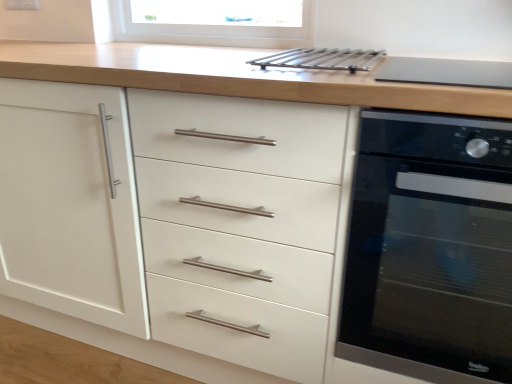
Locate an element on the screen. This screenshot has width=512, height=384. matte black cooktop at upper right is located at coordinates (446, 72).

Does point (493, 78) come closer to viewer compared to point (436, 145)?

No, it is not.

From the image's perspective, does matte black cooktop at upper right appear lower than black glass oven at right?

Incorrect, from the image's perspective, matte black cooktop at upper right is higher than black glass oven at right.

Is matte black cooktop at upper right to the right of black glass oven at right from the viewer's perspective?

In fact, matte black cooktop at upper right is to the left of black glass oven at right.

Is metallic silver rack at upper center to the left of matte black cooktop at upper right from the viewer's perspective?

Correct, you'll find metallic silver rack at upper center to the left of matte black cooktop at upper right.

Is metallic silver rack at upper center positioned beyond the bounds of matte black cooktop at upper right?

Yes.

Is metallic silver rack at upper center shorter than matte black cooktop at upper right?

Indeed, metallic silver rack at upper center has a lesser height compared to matte black cooktop at upper right.

Based on the photo, does black glass oven at right appear on the left side of metallic silver rack at upper center?

Incorrect, black glass oven at right is not on the left side of metallic silver rack at upper center.

Which is behind, point (464, 220) or point (345, 51)?

Positioned behind is point (345, 51).

Considering the sizes of objects black glass oven at right and metallic silver rack at upper center in the image provided, who is bigger, black glass oven at right or metallic silver rack at upper center?

With larger size is black glass oven at right.

Which is closer, (x=409, y=372) or (x=403, y=64)?

Point (x=409, y=372).

This screenshot has height=384, width=512. In order to click on appliance above the black glass oven at right (from the image's perspective) in this screenshot , I will do `click(446, 72)`.

From a real-world perspective, which object rests below the other?

black glass oven at right, from a real-world perspective.

Is black glass oven at right outside of matte black cooktop at upper right?

Yes.

Is matte black cooktop at upper right facing away from metallic silver rack at upper center?

No, matte black cooktop at upper right is not facing away from metallic silver rack at upper center.

Would you say matte black cooktop at upper right is inside or outside metallic silver rack at upper center?

matte black cooktop at upper right is spatially situated outside metallic silver rack at upper center.

Considering the relative sizes of matte black cooktop at upper right and metallic silver rack at upper center in the image provided, is matte black cooktop at upper right thinner than metallic silver rack at upper center?

No, matte black cooktop at upper right is not thinner than metallic silver rack at upper center.

From the image's perspective, is matte black cooktop at upper right on metallic silver rack at upper center?

No, from the image's perspective, matte black cooktop at upper right is not above metallic silver rack at upper center.

Between metallic silver rack at upper center and black glass oven at right, which one has less height?

Standing shorter between the two is metallic silver rack at upper center.

Is metallic silver rack at upper center thinner than black glass oven at right?

Correct, the width of metallic silver rack at upper center is less than that of black glass oven at right.

Are metallic silver rack at upper center and black glass oven at right making contact?

No, metallic silver rack at upper center is not touching black glass oven at right.

The height and width of the screenshot is (384, 512). There is a black glass oven at right. Identify the location of appliance above it (from a real-world perspective). (446, 72).

Find the location of `appliance beneath the metallic silver rack at upper center (from a real-world perspective)`. appliance beneath the metallic silver rack at upper center (from a real-world perspective) is located at coordinates (446, 72).

Based on their spatial positions, is black glass oven at right or metallic silver rack at upper center further from matte black cooktop at upper right?

black glass oven at right is positioned further to the anchor matte black cooktop at upper right.

Looking at this image, considering their positions, is matte black cooktop at upper right positioned further to black glass oven at right than metallic silver rack at upper center?

Among the two, matte black cooktop at upper right is located further to black glass oven at right.

When comparing their distances from metallic silver rack at upper center, does matte black cooktop at upper right or black glass oven at right seem closer?

matte black cooktop at upper right.

Which object lies nearer to the anchor point black glass oven at right, metallic silver rack at upper center or matte black cooktop at upper right?

The object closer to black glass oven at right is metallic silver rack at upper center.

Estimate the real-world distances between objects in this image. Which object is further from matte black cooktop at upper right, metallic silver rack at upper center or black glass oven at right?

black glass oven at right.

When comparing their distances from metallic silver rack at upper center, does black glass oven at right or matte black cooktop at upper right seem closer?

Among the two, matte black cooktop at upper right is located nearer to metallic silver rack at upper center.

Locate an element on the screen. The height and width of the screenshot is (384, 512). appliance between metallic silver rack at upper center and black glass oven at right vertically is located at coordinates (446, 72).